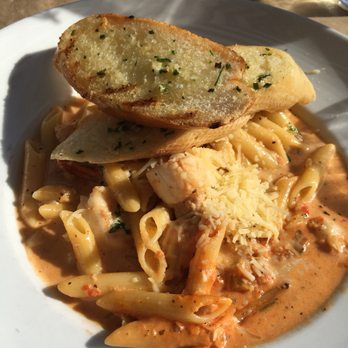
Locate an element on the screen. The height and width of the screenshot is (348, 348). plate is located at coordinates (54, 323).